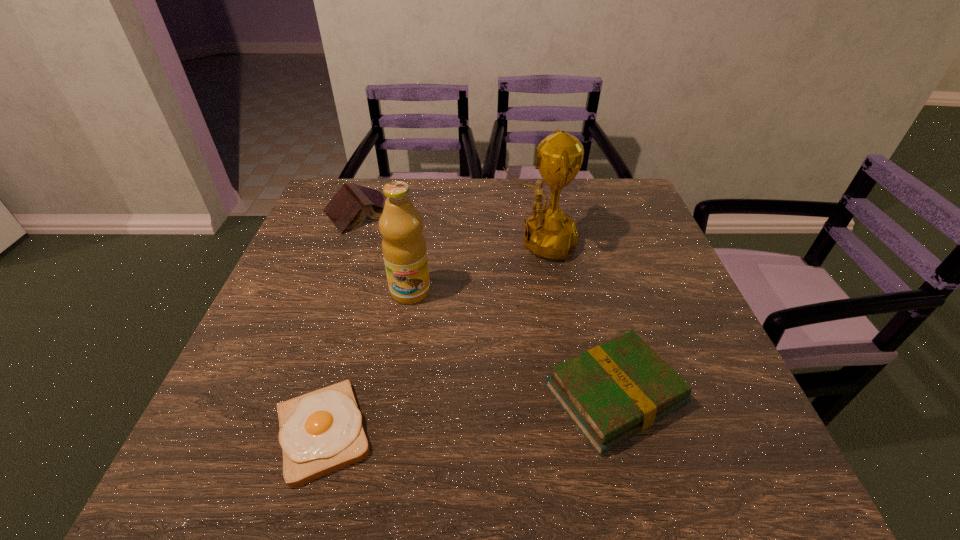
This screenshot has height=540, width=960. Identify the location of free point between the third farthest object and the award. (474, 267).

Find the location of a particular element. The height and width of the screenshot is (540, 960). free space that is in between the toast and the olive oil is located at coordinates (367, 362).

The image size is (960, 540). Identify the location of free space that is in between the award and the farther book. (450, 227).

Locate an element on the screen. vacant point located between the right book and the olive oil is located at coordinates (513, 343).

The width and height of the screenshot is (960, 540). I want to click on vacant area that lies between the award and the toast, so click(430, 337).

At what (x,y) coordinates should I click in order to perform the action: click on free space between the award and the left book. Please return your answer as a coordinate pair (x, y). This screenshot has width=960, height=540. Looking at the image, I should click on (450, 227).

Locate an element on the screen. Image resolution: width=960 pixels, height=540 pixels. unoccupied area between the shortest object and the right book is located at coordinates (468, 414).

Find the location of `free space between the toast and the olive oil`. free space between the toast and the olive oil is located at coordinates (367, 362).

The image size is (960, 540). Find the location of `object that stands as the second closest to the farther book`. object that stands as the second closest to the farther book is located at coordinates 549,233.

Select which object is the fourth closest to the third nearest object. Please provide its 2D coordinates. Your answer should be formatted as a tuple, i.e. [(x, y)], where the tuple contains the x and y coordinates of a point satisfying the conditions above.

[(611, 392)]